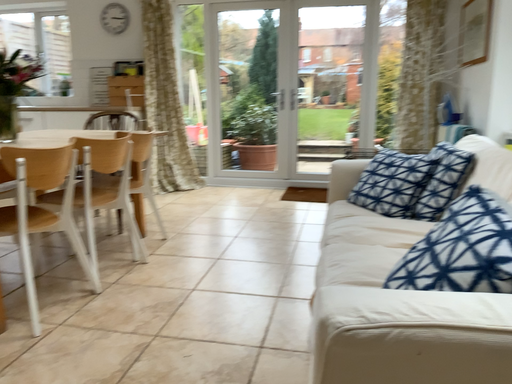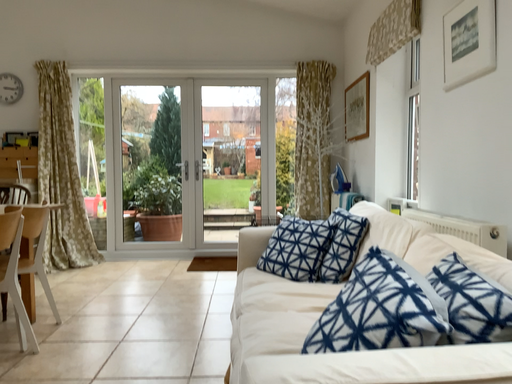
Question: Which way did the camera rotate in the video?

Choices:
 (A) rotated right
 (B) rotated left

Answer: (A)